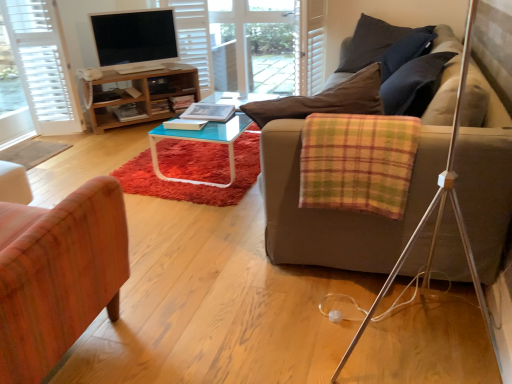
Question: Should I look upward or downward to see hardcover book at center, acting as the first book starting from the back?

Choices:
 (A) down
 (B) up

Answer: (B)

Question: Can you confirm if plaid fabric blanket at right is thinner than hardcover book at center, which is the 2th book from front to back?

Choices:
 (A) yes
 (B) no

Answer: (A)

Question: Can you confirm if plaid fabric blanket at right is wider than hardcover book at center, which is the 2th book from front to back?

Choices:
 (A) yes
 (B) no

Answer: (B)

Question: Is plaid fabric blanket at right positioned in front of hardcover book at center, acting as the first book starting from the back?

Choices:
 (A) no
 (B) yes

Answer: (B)

Question: Are plaid fabric blanket at right and hardcover book at center, acting as the first book starting from the back, far apart?

Choices:
 (A) yes
 (B) no

Answer: (A)

Question: Is plaid fabric blanket at right at the left side of hardcover book at center, which is the 2th book from front to back?

Choices:
 (A) yes
 (B) no

Answer: (B)

Question: Does plaid fabric blanket at right turn towards hardcover book at center, acting as the first book starting from the back?

Choices:
 (A) no
 (B) yes

Answer: (A)

Question: Can you confirm if wooden cabinet at upper left is shorter than dark blue fabric pillow at upper right?

Choices:
 (A) no
 (B) yes

Answer: (B)

Question: Is dark blue fabric pillow at upper right inside wooden cabinet at upper left?

Choices:
 (A) yes
 (B) no

Answer: (B)

Question: Can you confirm if wooden cabinet at upper left is taller than dark blue fabric pillow at upper right?

Choices:
 (A) no
 (B) yes

Answer: (A)

Question: From a real-world perspective, does wooden cabinet at upper left sit lower than dark blue fabric pillow at upper right?

Choices:
 (A) yes
 (B) no

Answer: (A)

Question: Is wooden cabinet at upper left to the right of dark blue fabric pillow at upper right from the viewer's perspective?

Choices:
 (A) yes
 (B) no

Answer: (B)

Question: Can you confirm if wooden cabinet at upper left is positioned to the left of dark blue fabric pillow at upper right?

Choices:
 (A) yes
 (B) no

Answer: (A)

Question: From a real-world perspective, is dark blue fabric pillow at upper right beneath wooden chair at left?

Choices:
 (A) yes
 (B) no

Answer: (B)